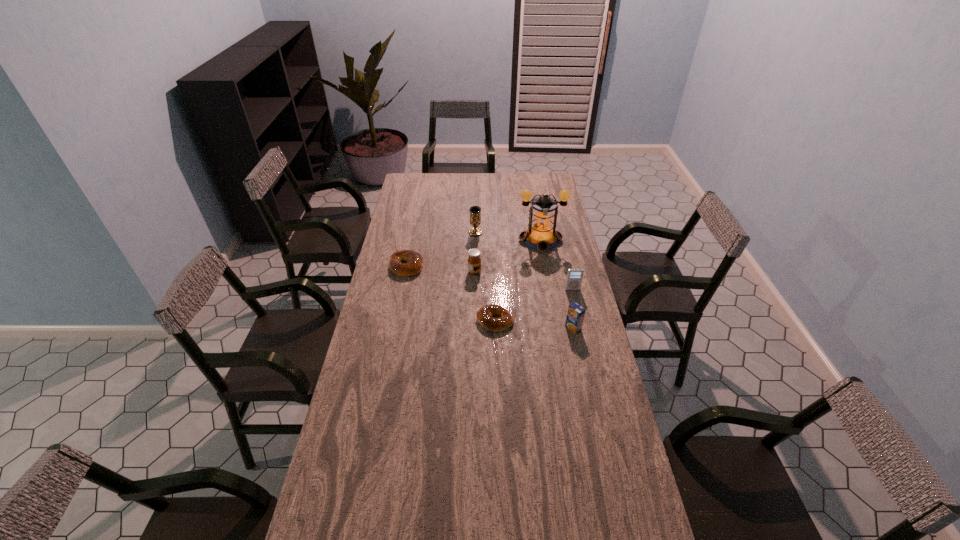
Image resolution: width=960 pixels, height=540 pixels. In order to click on unoccupied area between the fifth farthest object and the honey in this screenshot , I will do `click(523, 280)`.

Image resolution: width=960 pixels, height=540 pixels. Identify the location of unoccupied area between the honey and the third nearest object. (523, 280).

At what (x,y) coordinates should I click in order to perform the action: click on vacant area between the chalice and the third nearest object. Please return your answer as a coordinate pair (x, y). Looking at the image, I should click on (524, 261).

Identify the location of empty space that is in between the fifth farthest object and the nearer bagel. The height and width of the screenshot is (540, 960). (534, 305).

Locate an element on the screen. This screenshot has width=960, height=540. object that is the fourth closest to the fifth farthest object is located at coordinates (474, 261).

Find the location of a particular element. The height and width of the screenshot is (540, 960). the fifth closest object to the chalice is located at coordinates (574, 276).

Locate an element on the screen. Image resolution: width=960 pixels, height=540 pixels. free space that satisfies the following two spatial constraints: 1. on the front-facing side of the lantern; 2. on the front-facing side of the honey is located at coordinates (546, 272).

I want to click on free region that satisfies the following two spatial constraints: 1. on the front-facing side of the lantern; 2. on the front-facing side of the honey, so click(546, 272).